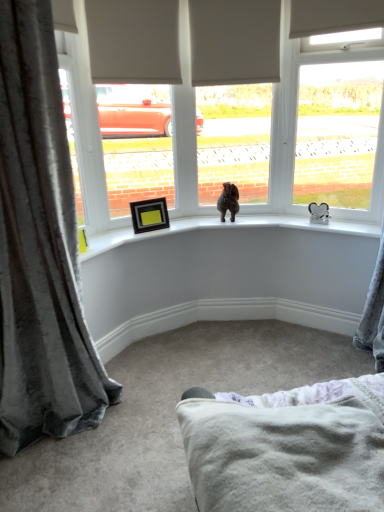
Question: Is brown plush bear at center closer to camera compared to velvet gray curtain at left?

Choices:
 (A) yes
 (B) no

Answer: (B)

Question: Is brown plush bear at center outside of velvet gray curtain at left?

Choices:
 (A) yes
 (B) no

Answer: (A)

Question: Is brown plush bear at center at the left side of velvet gray curtain at left?

Choices:
 (A) no
 (B) yes

Answer: (A)

Question: Does brown plush bear at center have a greater width compared to velvet gray curtain at left?

Choices:
 (A) yes
 (B) no

Answer: (B)

Question: From the image's perspective, would you say brown plush bear at center is positioned over velvet gray curtain at left?

Choices:
 (A) yes
 (B) no

Answer: (A)

Question: Is brown plush bear at center directly adjacent to velvet gray curtain at left?

Choices:
 (A) no
 (B) yes

Answer: (A)

Question: Is the position of soft white fleece blanket at lower center less distant than that of velvet gray curtain at left?

Choices:
 (A) yes
 (B) no

Answer: (A)

Question: From the image's perspective, is soft white fleece blanket at lower center on top of velvet gray curtain at left?

Choices:
 (A) no
 (B) yes

Answer: (A)

Question: Does soft white fleece blanket at lower center turn towards velvet gray curtain at left?

Choices:
 (A) yes
 (B) no

Answer: (B)

Question: From a real-world perspective, is soft white fleece blanket at lower center located beneath velvet gray curtain at left?

Choices:
 (A) yes
 (B) no

Answer: (A)

Question: Considering the relative sizes of soft white fleece blanket at lower center and velvet gray curtain at left in the image provided, is soft white fleece blanket at lower center smaller than velvet gray curtain at left?

Choices:
 (A) yes
 (B) no

Answer: (A)

Question: Considering the relative sizes of soft white fleece blanket at lower center and velvet gray curtain at left in the image provided, is soft white fleece blanket at lower center bigger than velvet gray curtain at left?

Choices:
 (A) no
 (B) yes

Answer: (A)

Question: Is velvet gray curtain at left not within white plastic window at upper right?

Choices:
 (A) yes
 (B) no

Answer: (A)